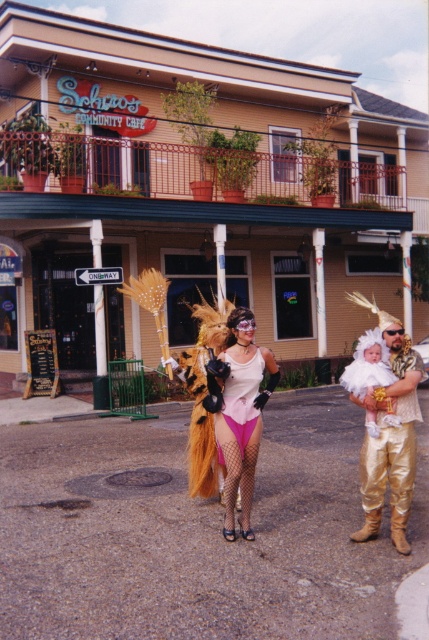
Looking at this image, you are a photographer at the event and want to position yourself so that the shiny gold costume at center and the pink satin dress at center are both in your frame. According to the scene, which costume should you place on the left side of your frame?

The pink satin dress at center should be placed on the left side of your frame because the shiny gold costume at center is to the right of it.

You are a photographer trying to capture the pink fishnet stockings at center and the pink satin dress at center in the same frame. Which object should you focus on first to ensure both are in the frame?

Since the pink fishnet stockings at center is much taller than the pink satin dress at center, you should focus on the pink fishnet stockings at center first to ensure both are in the frame.

You are standing at the point marked by the coordinate point at (387,477). You want to walk to the entrance of the cafe. The cafe entrance is 5.67 meters away from your current position. Is the cafe entrance in front of you or behind you?

The cafe entrance is 5.67 meters away from the point at (387,477), so it is in front of you since you are facing the cafe building.